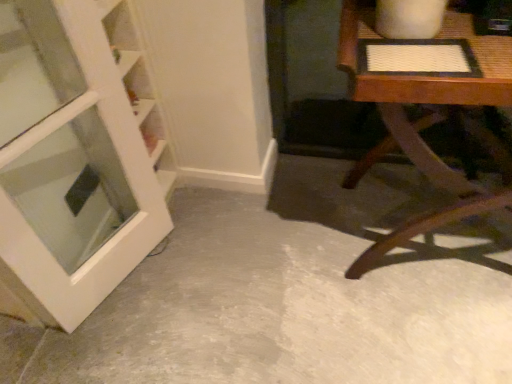
Question: Should I look upward or downward to see gray concrete floor at center?

Choices:
 (A) down
 (B) up

Answer: (A)

Question: Is white glossy door at left a part of gray concrete floor at center?

Choices:
 (A) yes
 (B) no

Answer: (B)

Question: Are gray concrete floor at center and white glossy door at left located far from each other?

Choices:
 (A) no
 (B) yes

Answer: (A)

Question: Considering the relative sizes of gray concrete floor at center and white glossy door at left in the image provided, is gray concrete floor at center thinner than white glossy door at left?

Choices:
 (A) yes
 (B) no

Answer: (B)

Question: From the image's perspective, would you say gray concrete floor at center is positioned over white glossy door at left?

Choices:
 (A) no
 (B) yes

Answer: (A)

Question: Does gray concrete floor at center come behind white glossy door at left?

Choices:
 (A) yes
 (B) no

Answer: (A)

Question: Is gray concrete floor at center wider than white glossy door at left?

Choices:
 (A) no
 (B) yes

Answer: (B)

Question: From a real-world perspective, is white glossy door at left on top of gray concrete floor at center?

Choices:
 (A) yes
 (B) no

Answer: (A)

Question: From the image's perspective, is white glossy door at left beneath gray concrete floor at center?

Choices:
 (A) yes
 (B) no

Answer: (B)

Question: Does white glossy door at left turn towards gray concrete floor at center?

Choices:
 (A) no
 (B) yes

Answer: (B)

Question: From a real-world perspective, is white glossy door at left located beneath gray concrete floor at center?

Choices:
 (A) yes
 (B) no

Answer: (B)

Question: From the image's perspective, is white glossy door at left above gray concrete floor at center?

Choices:
 (A) no
 (B) yes

Answer: (B)

Question: Is gray concrete floor at center located within white glossy door at left?

Choices:
 (A) yes
 (B) no

Answer: (B)

Question: Is white glossy door at left turned away from wooden textured table at right?

Choices:
 (A) no
 (B) yes

Answer: (A)